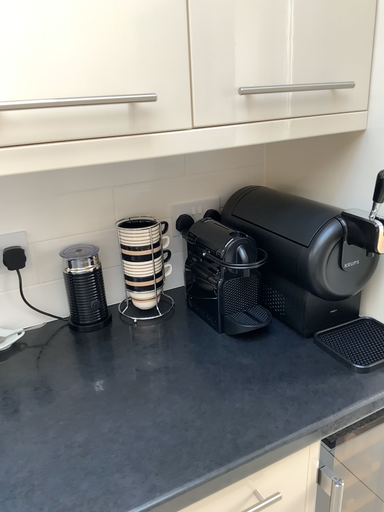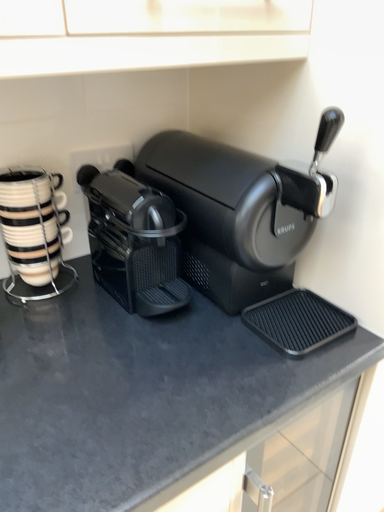
Question: Which way did the camera rotate in the video?

Choices:
 (A) rotated left
 (B) rotated right

Answer: (B)